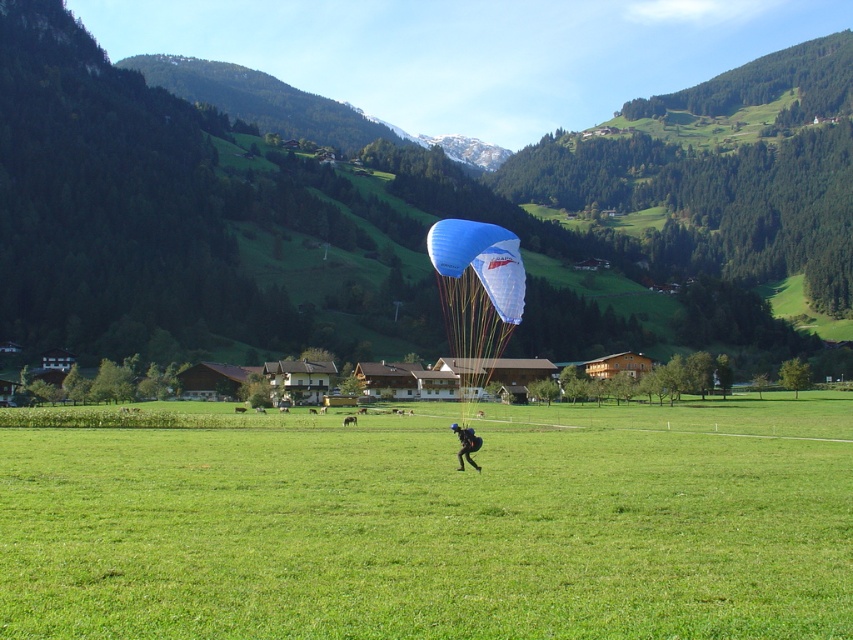
Based on the scene description, where is the green forested mountain at upper center located in the image?

The green forested mountain at upper center is located at point coordinates of (398, 205).

Consider the image. You are standing in the field and want to walk from point [459,342] to point [479,444]. Which direction should you face to move towards the latter?

You should face away from the camera because point [459,342] is closer to the camera than point [479,444].

You are a photographer trying to capture the parachutist in the alpine landscape. You notice two parachutes at center. Which parachute is closer to the camera? Please choose between the blue fabric parachute at center and the matte black parachute at center.

The blue fabric parachute at center is closer to the camera because the matte black parachute at center is behind it.